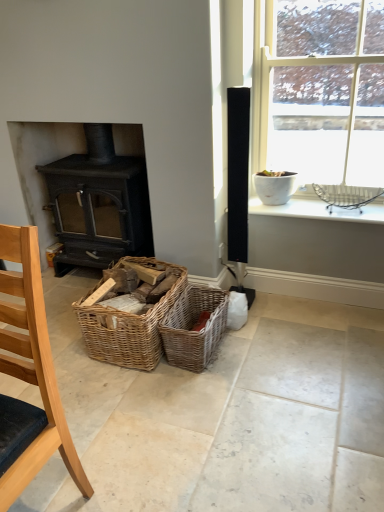
The width and height of the screenshot is (384, 512). In order to click on free area below metallic wire basket at upper right (from a real-world perspective) in this screenshot , I will do 342,209.